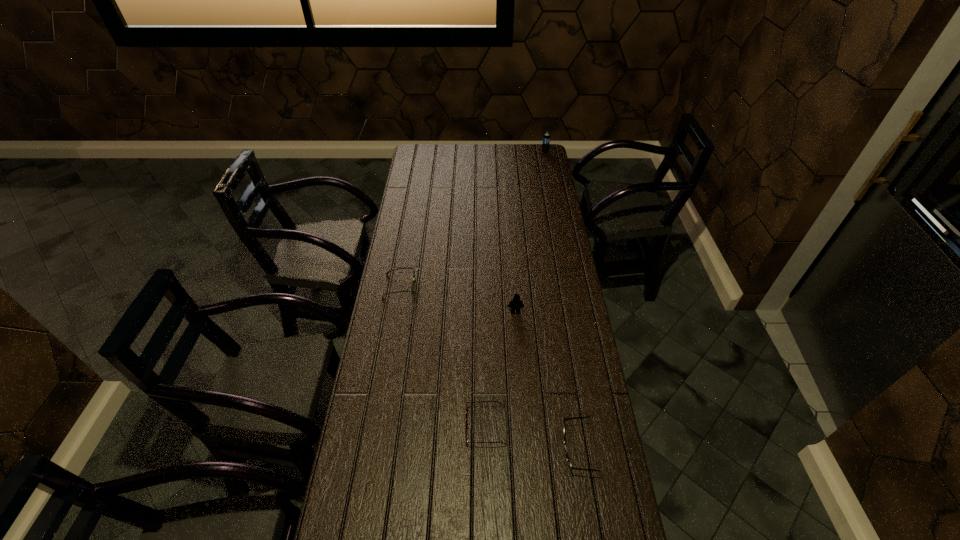
Where is `the tallest object`? the tallest object is located at coordinates (546, 138).

Where is `the farthest object`? The image size is (960, 540). the farthest object is located at coordinates (546, 138).

Identify the location of the third farthest object. The height and width of the screenshot is (540, 960). (516, 303).

This screenshot has width=960, height=540. I want to click on the second tallest object, so click(x=516, y=303).

The width and height of the screenshot is (960, 540). Find the location of `the third tallest object`. the third tallest object is located at coordinates (567, 456).

Locate an element on the screen. The width and height of the screenshot is (960, 540). the tallest spectacles is located at coordinates (567, 456).

Identify the location of the leftmost spectacles. (412, 285).

Locate an element on the screen. Image resolution: width=960 pixels, height=540 pixels. the fourth tallest object is located at coordinates (412, 285).

You are a GUI agent. You are given a task and a screenshot of the screen. Output one action in this format:
    pyautogui.click(x=<x>, y=<y>)
    Task: Click on the shortest object
    The height and width of the screenshot is (540, 960).
    Given the screenshot: What is the action you would take?
    click(x=466, y=425)

Locate an element on the screen. This screenshot has width=960, height=540. the second object from left to right is located at coordinates (466, 425).